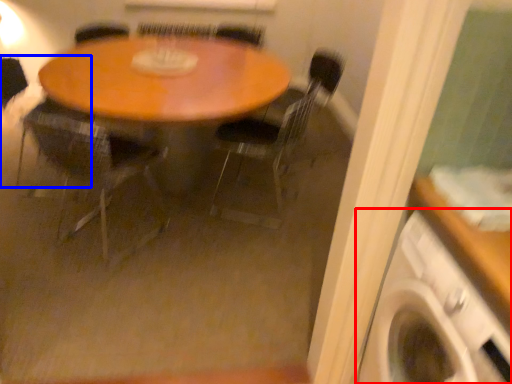
Question: Which object is further to the camera taking this photo, washing machine (highlighted by a red box) or armchair (highlighted by a blue box)?

Choices:
 (A) washing machine
 (B) armchair

Answer: (B)